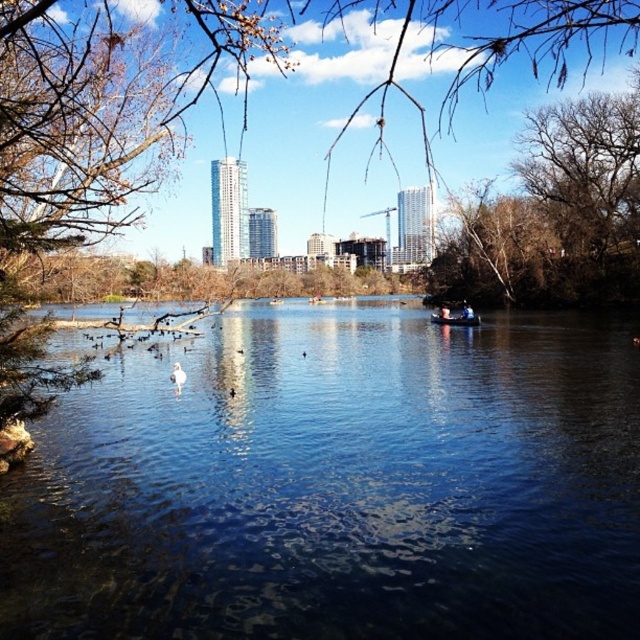
You are an architect designing a new park and want to ensure that the clear blue water at center and the brown textured tree at center are visible from a central viewing platform. Based on their heights, which object will appear taller from the platform?

The brown textured tree at center will appear taller than the clear blue water at center because the brown textured tree at center has a greater height according to the description.

You are standing at the edge of the water in the park and see the point at coordinates point (456, 316). Which object is this point located on?

The point (456, 316) is located on the metallic blue boat at center.

You are standing at the center of the park and want to take a photo of the metallic blue boat at center. Which direction should you face to ensure the boat is in the center of your photo?

Since the metallic blue boat at center is located at the point (456, 316), which is very close to the center of the image, you should face directly towards the center of the park to have the boat in the center of your photo.